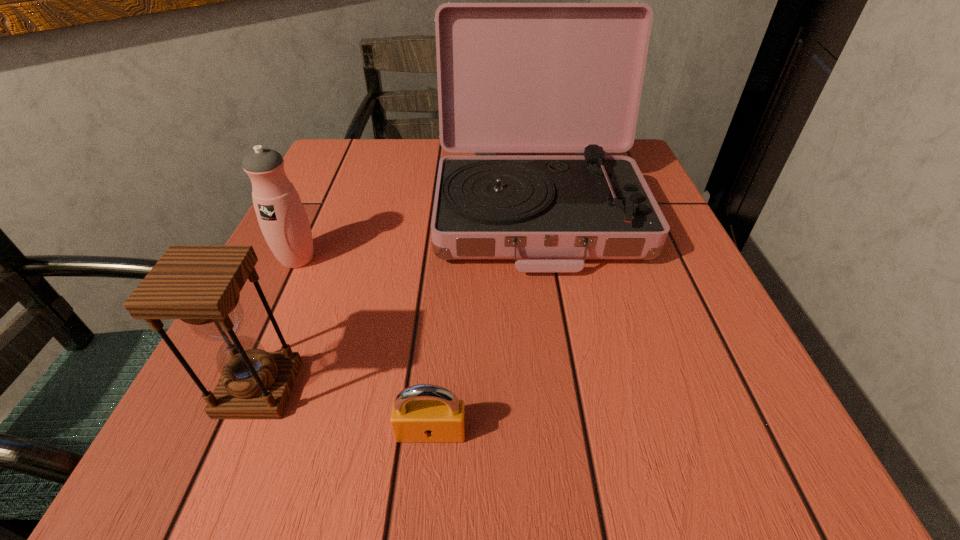
You are a GUI agent. You are given a task and a screenshot of the screen. Output one action in this format:
    pyautogui.click(x=<x>, y=<y>)
    Task: Click on the tallest object
    The width and height of the screenshot is (960, 540).
    Given the screenshot: What is the action you would take?
    pyautogui.click(x=512, y=77)

Identify the location of thermos bottle. This screenshot has height=540, width=960. (284, 223).

The height and width of the screenshot is (540, 960). I want to click on hourglass, so click(x=200, y=285).

You are a GUI agent. You are given a task and a screenshot of the screen. Output one action in this format:
    pyautogui.click(x=<x>, y=<y>)
    Task: Click on the shortest object
    The width and height of the screenshot is (960, 540).
    Given the screenshot: What is the action you would take?
    pyautogui.click(x=442, y=420)

Find the location of a particular element. padlock is located at coordinates (442, 420).

Image resolution: width=960 pixels, height=540 pixels. I want to click on free location located 0.100m with the lid open on the tallest object, so click(x=556, y=323).

I want to click on vacant area situated on the back of the thermos bottle, so click(x=333, y=181).

Image resolution: width=960 pixels, height=540 pixels. I want to click on free region located on the back of the hourglass, so click(x=290, y=315).

Where is `vacant space located 0.050m to unlock the padlock from the front`? This screenshot has height=540, width=960. vacant space located 0.050m to unlock the padlock from the front is located at coordinates (426, 485).

The width and height of the screenshot is (960, 540). I want to click on object located at the far edge, so click(512, 77).